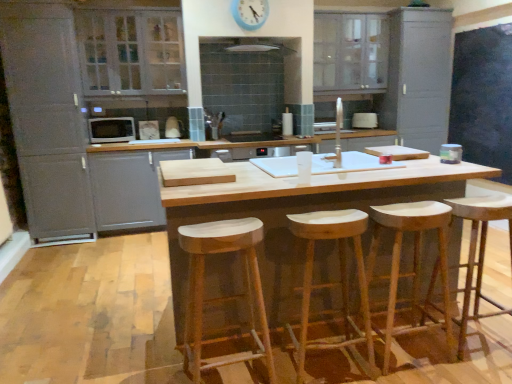
This screenshot has width=512, height=384. Find the location of `vacant region to the left of natural wood counter at center`. vacant region to the left of natural wood counter at center is located at coordinates (106, 307).